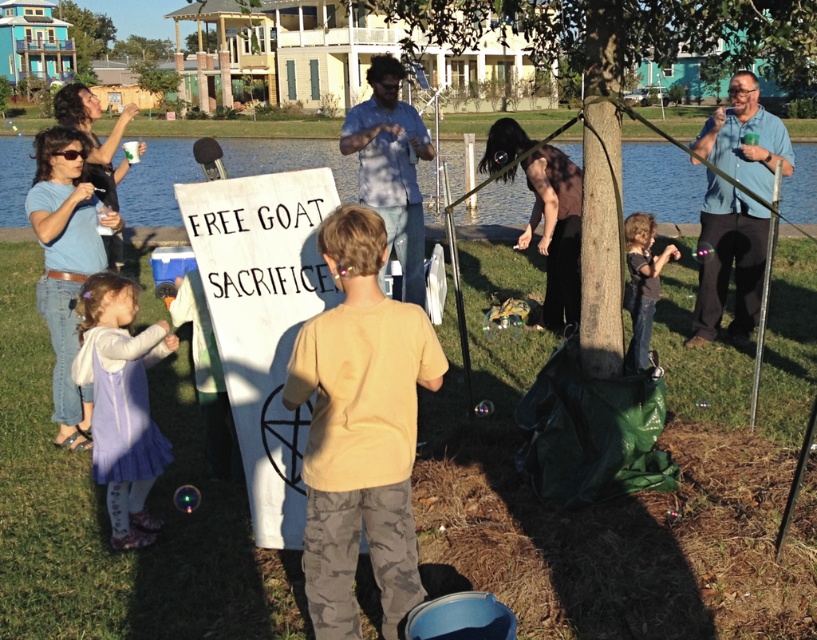
Is blue shirt at upper right above green leafy tree at upper center?

Actually, blue shirt at upper right is below green leafy tree at upper center.

Does blue shirt at upper right appear on the right side of green leafy tree at upper center?

Indeed, blue shirt at upper right is positioned on the right side of green leafy tree at upper center.

Measure the distance between blue shirt at upper right and camera.

The distance of blue shirt at upper right from camera is 4.81 meters.

Identify the location of blue shirt at upper right. (730, 262).

Is blue water at lake left taller than blue shirt at upper right?

Correct, blue water at lake left is much taller as blue shirt at upper right.

Does blue water at lake left have a smaller size compared to blue shirt at upper right?

No.

Which is in front, point (158, 166) or point (739, 221)?

Point (739, 221)

Where is `blue water at lake left`? Image resolution: width=817 pixels, height=640 pixels. blue water at lake left is located at coordinates (661, 180).

Is purple fabric dress at lower left positioned before blue shirt at upper right?

Yes, purple fabric dress at lower left is closer to the viewer.

Can you confirm if purple fabric dress at lower left is wider than blue shirt at upper right?

No.

Between point (105, 413) and point (744, 305), which one is positioned in front?

Positioned in front is point (105, 413).

What are the coordinates of `purple fabric dress at lower left` in the screenshot? It's located at (121, 403).